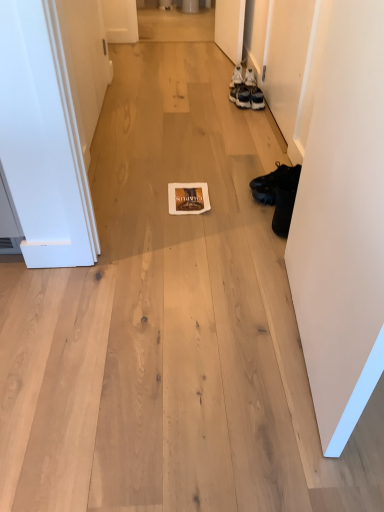
Question: In terms of height, does matte black sneakers at upper right, marked as the 2th footwear in a back-to-front arrangement, look taller or shorter compared to matte brown magazine at center?

Choices:
 (A) tall
 (B) short

Answer: (A)

Question: Considering the positions of matte black sneakers at upper right, which is the third footwear from front to back, and matte brown magazine at center in the image, is matte black sneakers at upper right, which is the third footwear from front to back, wider or thinner than matte brown magazine at center?

Choices:
 (A) wide
 (B) thin

Answer: (B)

Question: Which of these objects is positioned farthest from the white matte door at right, arranged as the second door when viewed from the top?

Choices:
 (A) white painted wood door at left, which is counted as the first door, starting from the top
 (B) matte brown magazine at center
 (C) black leather boot at right, marked as the first footwear in a bottom-to-top arrangement
 (D) white leather sneakers at upper right, which ranks as the 1th footwear in back-to-front order
 (E) matte black sneakers at upper right, which is the 3th footwear from bottom to top

Answer: (D)

Question: Based on their relative distances, which object is nearer to the white painted wood door at left, which appears as the second door when ordered from the bottom?

Choices:
 (A) matte brown magazine at center
 (B) white matte door at right, which is the first door from bottom to top
 (C) black leather boot at right, which is counted as the 3th footwear, starting from the top
 (D) white leather sneakers at upper right, which ranks as the 1th footwear in back-to-front order
 (E) black leather boot at right, the 1th footwear positioned from the front

Answer: (A)